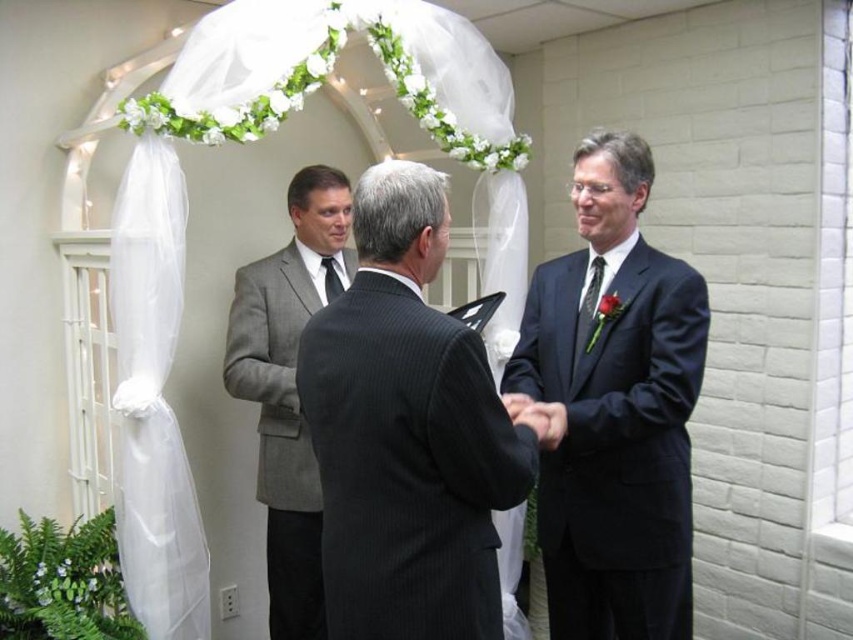
Question: Which of the following is the farthest from the observer?

Choices:
 (A) matte black suit at right
 (B) dark gray pinstripe suit at center
 (C) gray textured suit at center

Answer: (C)

Question: Which point is farther from the camera taking this photo?

Choices:
 (A) (570, 460)
 (B) (271, 310)

Answer: (B)

Question: Which of these objects is positioned farthest from the dark gray pinstripe suit at center?

Choices:
 (A) matte black suit at right
 (B) gray textured suit at center

Answer: (B)

Question: Is matte black suit at right wider than gray textured suit at center?

Choices:
 (A) no
 (B) yes

Answer: (B)

Question: Does dark gray pinstripe suit at center appear on the right side of gray textured suit at center?

Choices:
 (A) yes
 (B) no

Answer: (A)

Question: Is matte black suit at right above gray textured suit at center?

Choices:
 (A) yes
 (B) no

Answer: (A)